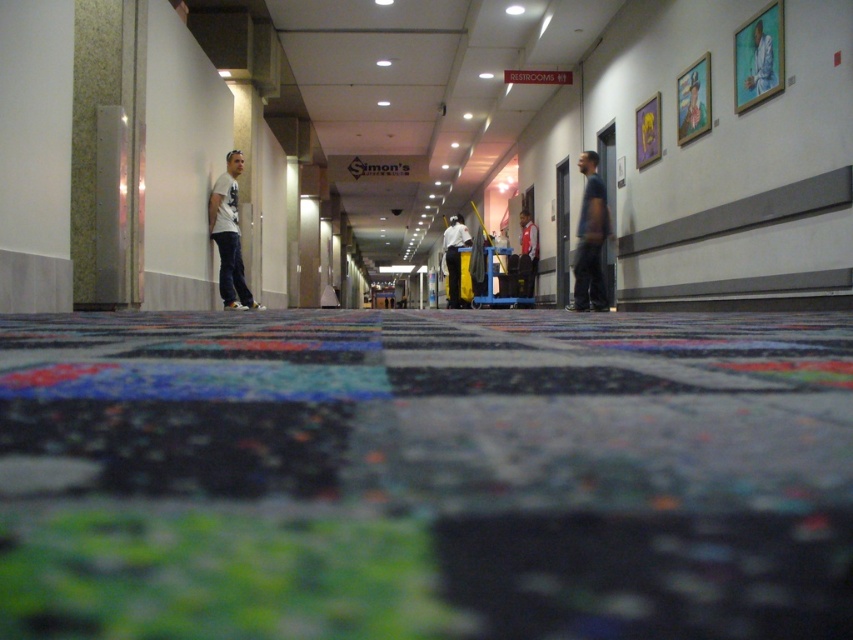
Can you confirm if blue fabric shirt at upper right is smaller than red shirt at center?

Yes.

Can you confirm if blue fabric shirt at upper right is positioned to the right of red shirt at center?

Indeed, blue fabric shirt at upper right is positioned on the right side of red shirt at center.

Locate an element on the screen. The image size is (853, 640). blue fabric shirt at upper right is located at coordinates (759, 61).

Identify the location of blue fabric shirt at upper right. (759, 61).

Which is behind, point (589, 289) or point (772, 52)?

The point (589, 289) is behind.

Does point (583, 296) come closer to viewer compared to point (750, 84)?

No, (583, 296) is behind (750, 84).

Locate an element on the screen. dark blue shirt at right is located at coordinates (590, 237).

Between point (242, 161) and point (520, 256), which one is positioned behind?

Point (520, 256)

Does white matte t-shirt at left come in front of red shirt at center?

Yes.

Who is more forward, (216,204) or (532,278)?

Point (216,204) is more forward.

Where is `white matte t-shirt at left`? white matte t-shirt at left is located at coordinates click(x=229, y=236).